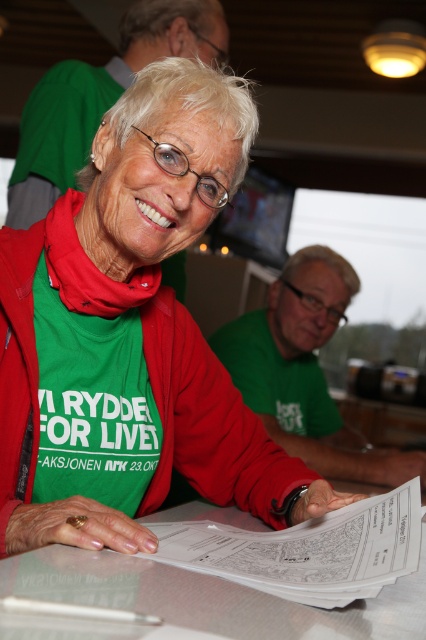
Question: Which point appears closest to the camera in this image?

Choices:
 (A) (187, 618)
 (B) (396, 452)

Answer: (A)

Question: Observing the image, what is the correct spatial positioning of green fabric shirt at center in reference to green matte shirt at center?

Choices:
 (A) right
 (B) left

Answer: (B)

Question: Which point is closer to the camera?

Choices:
 (A) white glossy table at center
 (B) green fabric shirt at center

Answer: (A)

Question: Does green fabric shirt at center appear on the left side of green matte shirt at center?

Choices:
 (A) yes
 (B) no

Answer: (A)

Question: Among these objects, which one is farthest from the camera?

Choices:
 (A) green fabric shirt at center
 (B) white glossy table at center

Answer: (A)

Question: Does green fabric shirt at center appear over white glossy table at center?

Choices:
 (A) yes
 (B) no

Answer: (A)